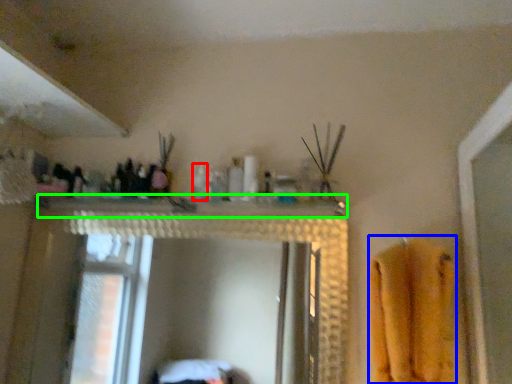
Question: Estimate the real-world distances between objects in this image. Which object is farther from toiletry (highlighted by a red box), bath towel (highlighted by a blue box) or counter top (highlighted by a green box)?

Choices:
 (A) bath towel
 (B) counter top

Answer: (A)